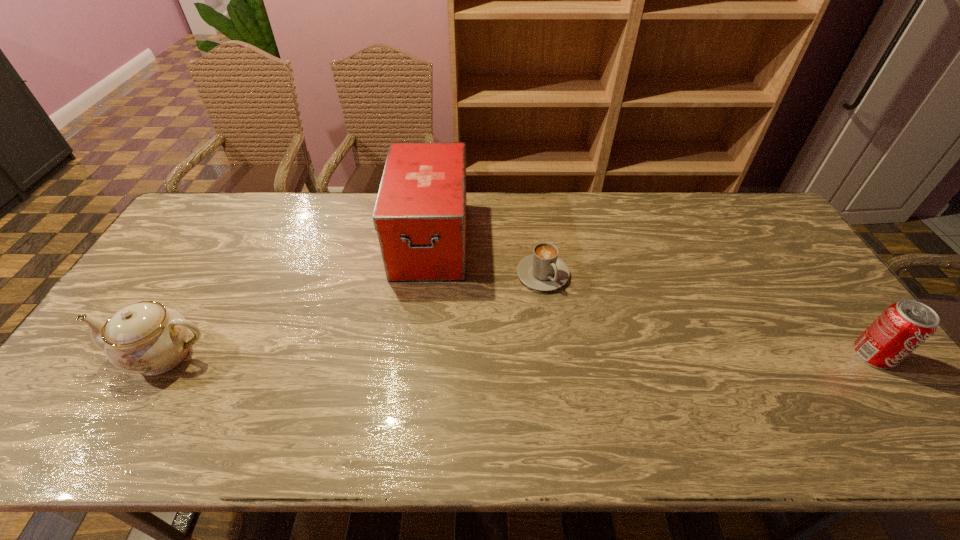
The height and width of the screenshot is (540, 960). I want to click on the leftmost object, so click(146, 337).

Identify the location of soda can. Image resolution: width=960 pixels, height=540 pixels. (903, 326).

Identify the location of the shortest object. (543, 270).

You are a GUI agent. You are given a task and a screenshot of the screen. Output one action in this format:
    pyautogui.click(x=<x>, y=<y>)
    Task: Click on the cappuccino
    
    Given the screenshot: What is the action you would take?
    pyautogui.click(x=543, y=270)

Find the location of `the third object from right to left`. the third object from right to left is located at coordinates (420, 214).

The width and height of the screenshot is (960, 540). In order to click on the first-aid kit in this screenshot , I will do `click(420, 214)`.

Locate an element on the screen. The image size is (960, 540). free point located on the back of the soda can is located at coordinates (794, 248).

Image resolution: width=960 pixels, height=540 pixels. Find the location of `vacant region located to the right of the cappuccino`. vacant region located to the right of the cappuccino is located at coordinates (572, 314).

The image size is (960, 540). In order to click on free region located to the right of the cappuccino in this screenshot , I will do `click(591, 341)`.

You are a GUI agent. You are given a task and a screenshot of the screen. Output one action in this format:
    pyautogui.click(x=<x>, y=<y>)
    Task: Click on the free space located to the right of the cappuccino
    This screenshot has height=540, width=960.
    Given the screenshot: What is the action you would take?
    pyautogui.click(x=618, y=379)